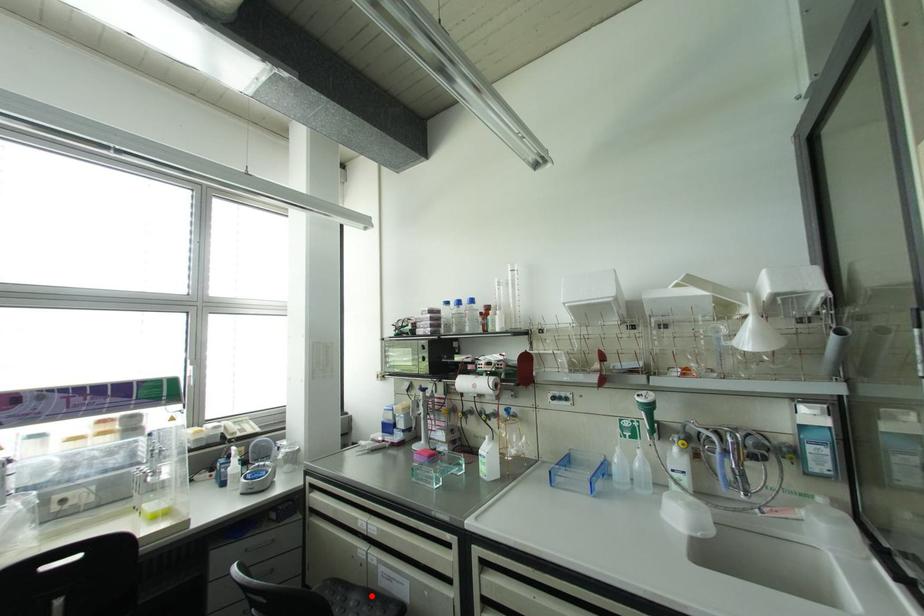
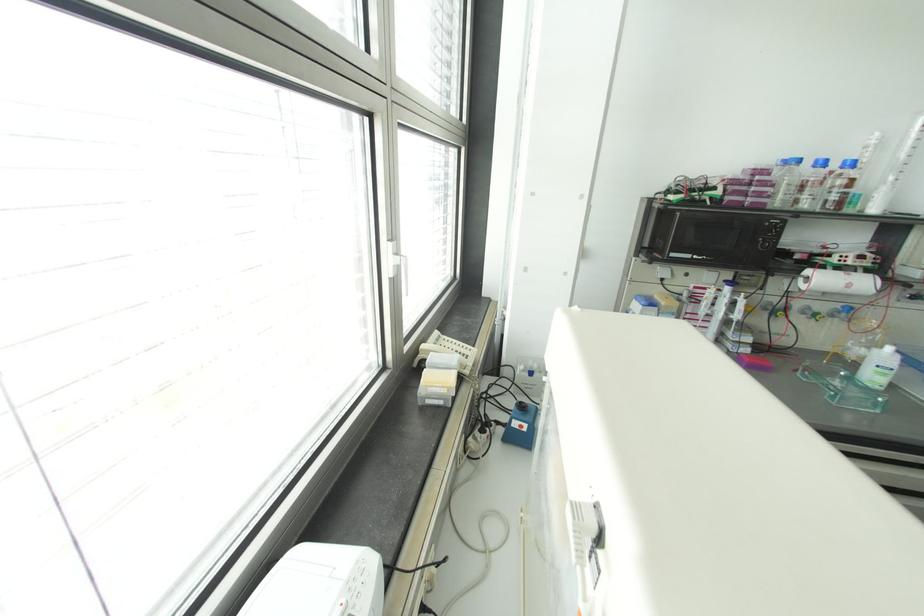
Question: I am providing you with two images of the same scene from different viewpoints. A red point is marked on the first image. Is the red point's position out of view in image 2?

Choices:
 (A) Yes
 (B) No

Answer: (A)